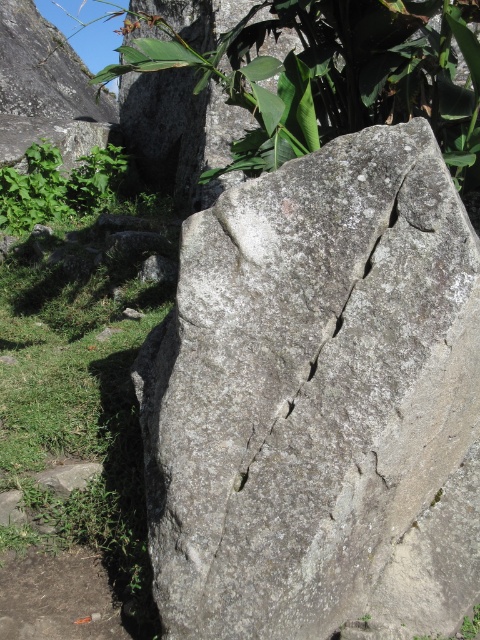
You are a hiker trying to cross a narrow path between two obstacles. You see a gray rough rock at center and a green leafy plant at center. Which obstacle has a smaller width that might be easier to navigate around?

The gray rough rock at center has a smaller width than the green leafy plant at center, so it might be easier to navigate around.

Consider the image. You are a hiker who wants to take a photo of the gray rough rock at center and the green leafy plant at center. Which object should you focus on first if you want both to be in clear focus, considering their sizes?

The gray rough rock at center is smaller than the green leafy plant at center, so you should focus on the green leafy plant at center first to ensure both are in clear focus.